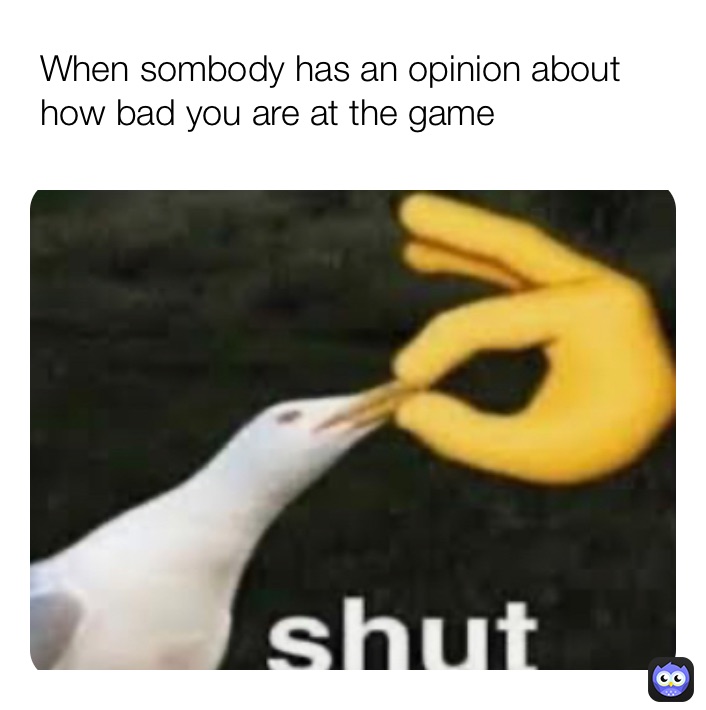
I want to click on picture, so click(x=510, y=517).